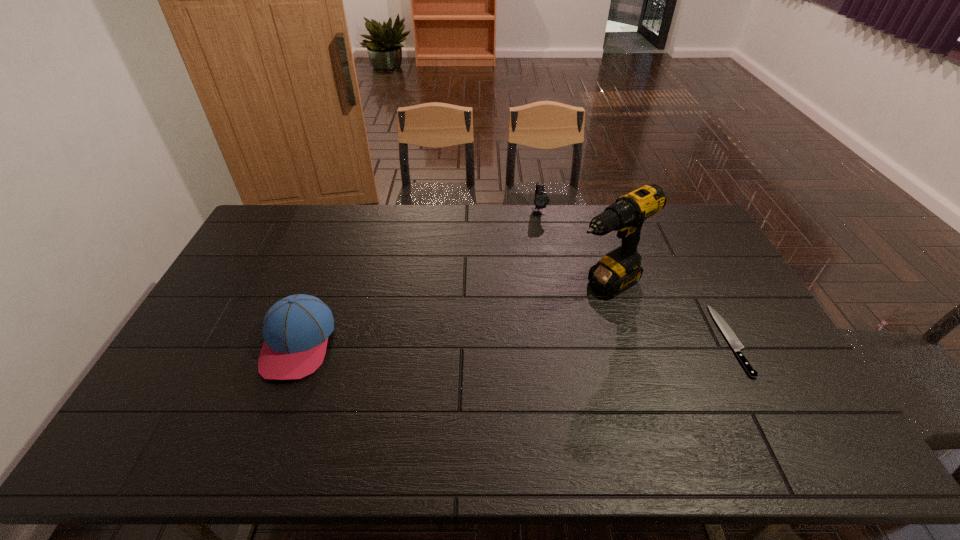
Where is `free spot on the desktop that is between the baseball cap and the rightmost object and is positioned on the face of the watch`? free spot on the desktop that is between the baseball cap and the rightmost object and is positioned on the face of the watch is located at coordinates (562, 341).

Find the location of a particular element. This screenshot has height=540, width=960. free spot on the desktop that is between the leftmost object and the shortest object and is positioned at the tip of the drill is located at coordinates 522,341.